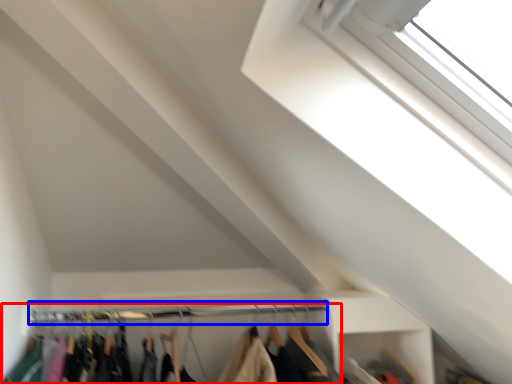
Question: Which of the following is the closest to the observer, closet (highlighted by a red box) or clothesline (highlighted by a blue box)?

Choices:
 (A) closet
 (B) clothesline

Answer: (A)